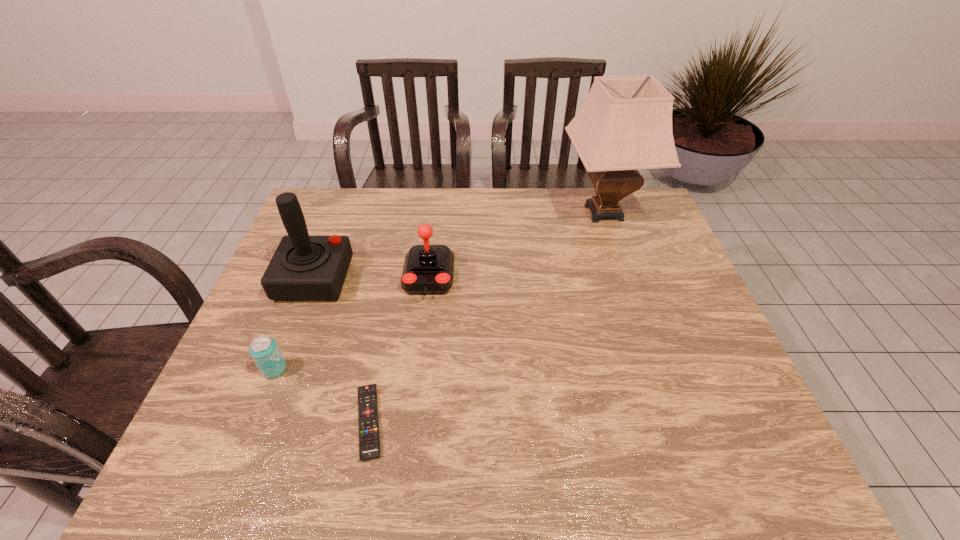
Where is `free space that satisfies the following two spatial constraints: 1. on the base of the taller joystick; 2. on the front side of the fourth tallest object`? free space that satisfies the following two spatial constraints: 1. on the base of the taller joystick; 2. on the front side of the fourth tallest object is located at coordinates (279, 369).

Identify the location of free location that satisfies the following two spatial constraints: 1. on the base of the right joystick; 2. on the base of the taller joystick. (429, 279).

I want to click on vacant area that satisfies the following two spatial constraints: 1. on the base of the right joystick; 2. on the base of the taller joystick, so click(x=429, y=279).